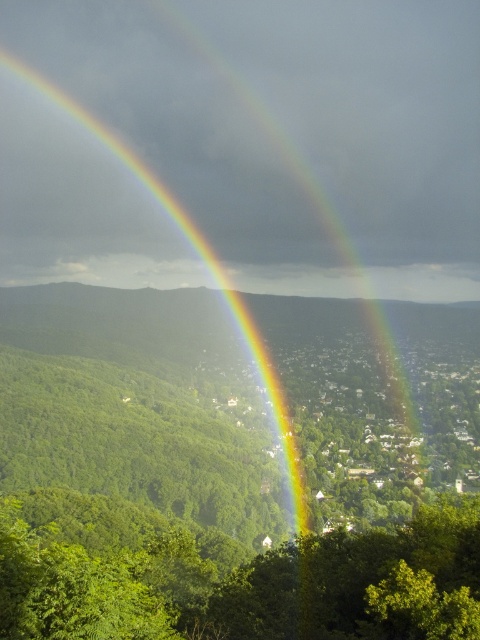
In the scene shown: You are standing in the middle of the forest and see the green leafy tree at center and the rainbow at center. Which object is closer to you?

The green leafy tree at center is closer to you because it is in front of the rainbow at center.

You are an observer standing in the middle of the forest looking towards the urban area. You see the green leafy tree at center and the rainbow at center. Which object is higher in the sky?

The rainbow at center is higher in the sky than the green leafy tree at center because the tree is located below the rainbow.